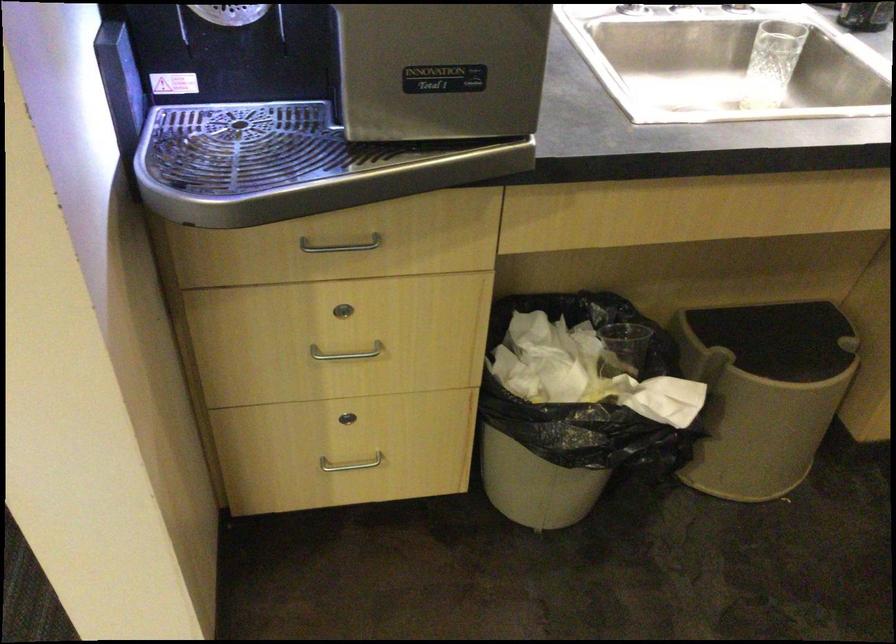
Identify the location of clear drinking glass. Image resolution: width=896 pixels, height=644 pixels. (771, 62).